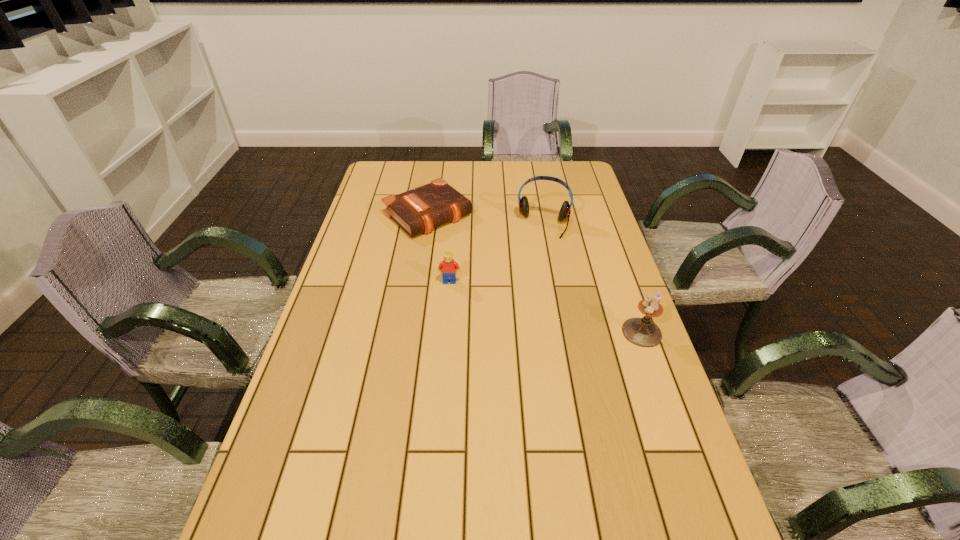
The height and width of the screenshot is (540, 960). I want to click on unoccupied area between the second nearest object and the headset, so click(497, 253).

Identify the location of object that ranks as the closest to the shortest object. click(x=565, y=211).

You are a GUI agent. You are given a task and a screenshot of the screen. Output one action in this format:
    pyautogui.click(x=<x>, y=<y>)
    Task: Click on the object that stands as the second closest to the shortest object
    The width and height of the screenshot is (960, 540).
    Given the screenshot: What is the action you would take?
    pyautogui.click(x=450, y=268)

Locate an element on the screen. The image size is (960, 540). free space in the image that satisfies the following two spatial constraints: 1. on the face of the second shortest object; 2. on the left side of the nearest object is located at coordinates (445, 332).

The width and height of the screenshot is (960, 540). Identify the location of vacant area that satisfies the following two spatial constraints: 1. on the face of the rightmost object; 2. on the left side of the third farthest object. (445, 332).

This screenshot has width=960, height=540. I want to click on free space that satisfies the following two spatial constraints: 1. on the face of the Lego; 2. on the left side of the rightmost object, so click(x=445, y=332).

Identify the location of vacant region that satisfies the following two spatial constraints: 1. on the face of the second shortest object; 2. on the left side of the nearest object. The height and width of the screenshot is (540, 960). (445, 332).